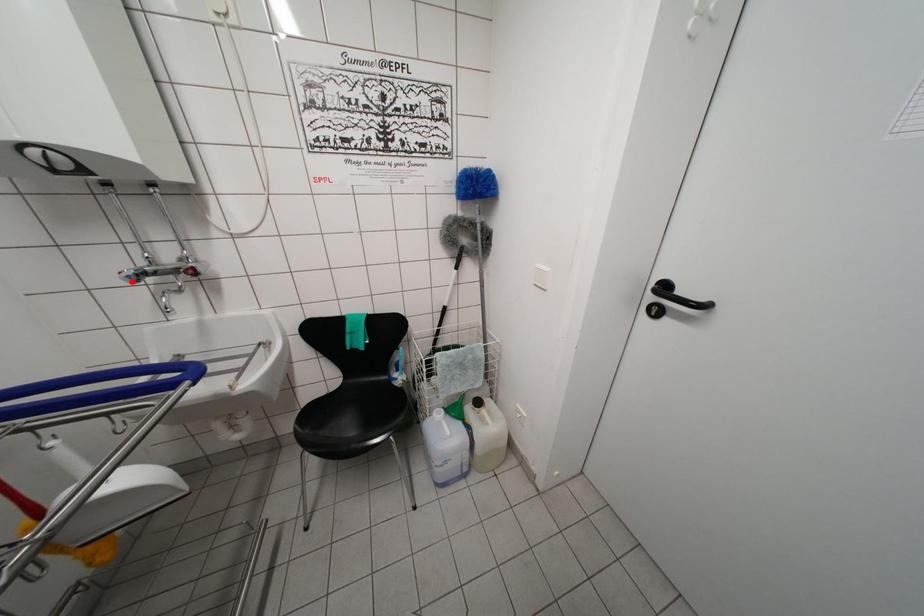
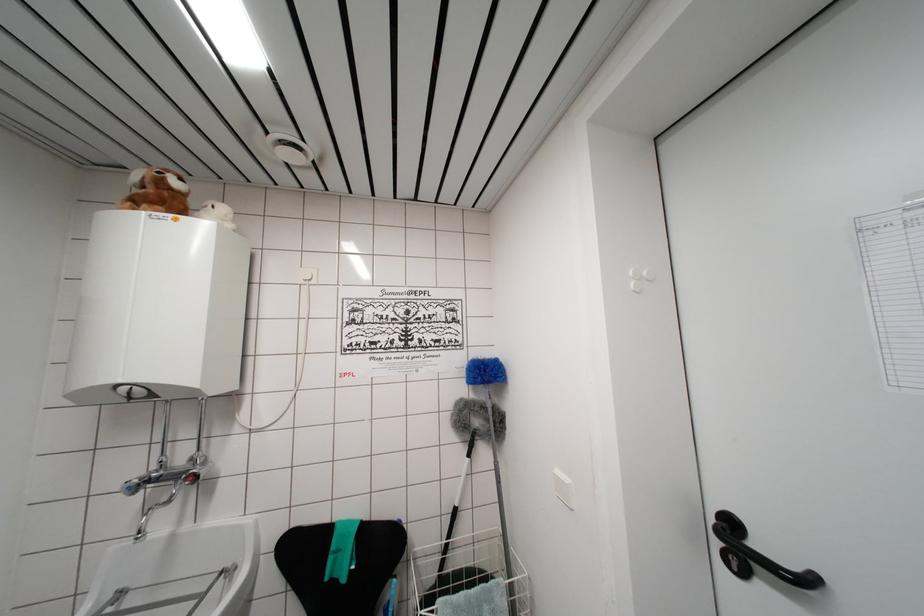
In the second image, find the point that corresponds to the highlighted location in the first image.

(132, 493)